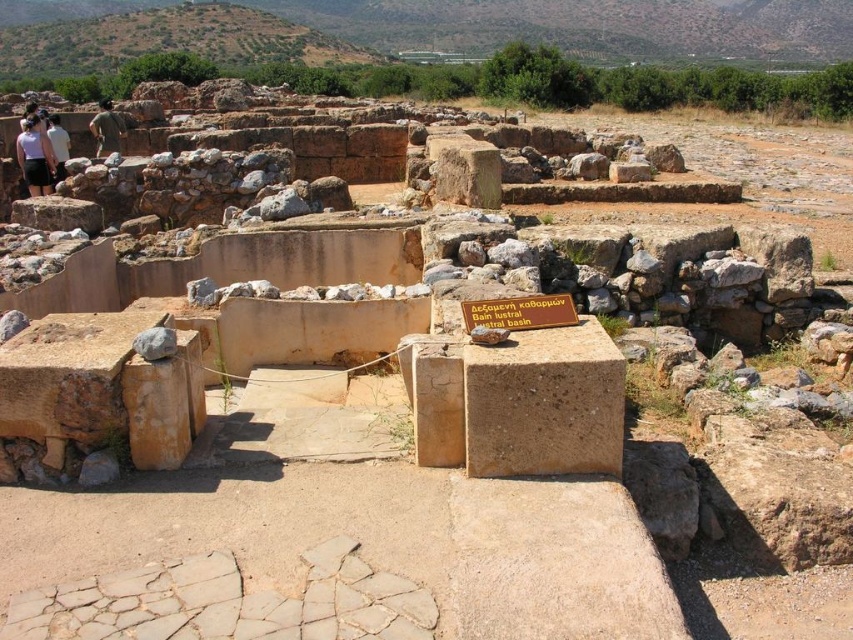
You are an archaeologist standing at the ruins of an ancient structure. You notice a point marked at coordinates (35, 156). What object is located at that point?

The object located at point (35, 156) is the matte white shirt at left.